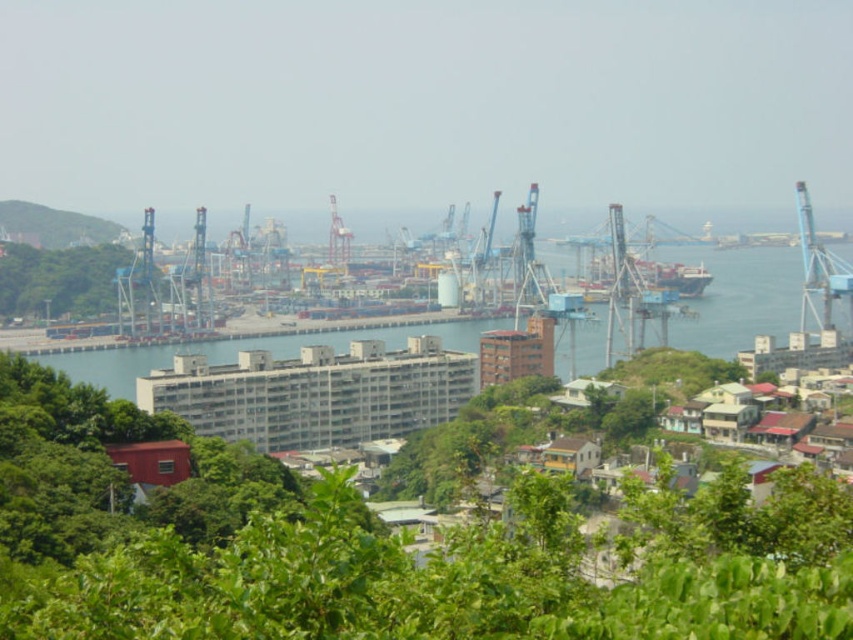
Question: Does blue water at center lie behind metallic gray crane at center?

Choices:
 (A) yes
 (B) no

Answer: (B)

Question: Which of these objects is positioned farthest from the blue metallic crane at right?

Choices:
 (A) green leafy tree at left
 (B) metallic gray container ship at center

Answer: (A)

Question: Does blue water at center have a larger size compared to metallic gray crane at center?

Choices:
 (A) yes
 (B) no

Answer: (A)

Question: Considering the real-world distances, which object is closest to the blue metallic crane at right?

Choices:
 (A) green leafy tree at center
 (B) blue water at center

Answer: (B)

Question: Can you confirm if blue metallic crane at right is wider than metallic gray container ship at center?

Choices:
 (A) no
 (B) yes

Answer: (A)

Question: Which point is closer to the camera?

Choices:
 (A) blue metallic crane at right
 (B) blue water at center
 (C) metallic gray container ship at center
 (D) green grassy hillside at upper left

Answer: (B)